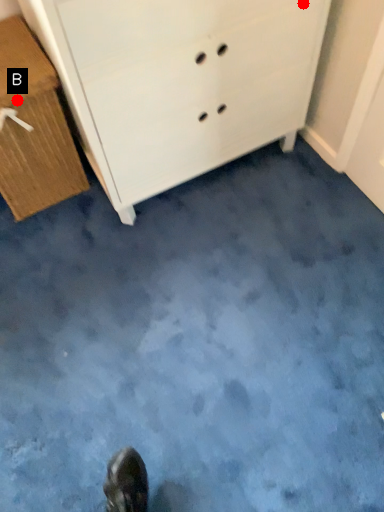
Question: Two points are circled on the image, labeled by A and B beside each circle. Among these points, which one is farthest from the camera?

Choices:
 (A) A is further
 (B) B is further

Answer: (B)